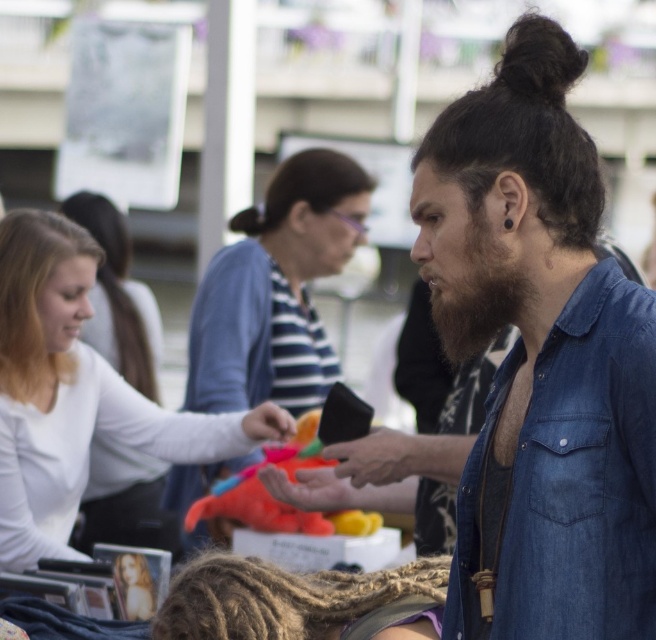
Measure the distance between white matte shirt at lower left and brown matte beard at center.

white matte shirt at lower left is 6.58 feet from brown matte beard at center.

Looking at this image, does white matte shirt at lower left appear on the right side of brown matte beard at center?

No, white matte shirt at lower left is not to the right of brown matte beard at center.

I want to click on white matte shirt at lower left, so click(75, 392).

Is brown matte beard at center to the right of plush orange toy at center from the viewer's perspective?

Correct, you'll find brown matte beard at center to the right of plush orange toy at center.

Which is behind, point (441, 316) or point (333, 524)?

Positioned behind is point (333, 524).

Where is `brown matte beard at center`? Image resolution: width=656 pixels, height=640 pixels. brown matte beard at center is located at coordinates (478, 292).

Between striped fabric shirt at center and plush orange toy at center, which one is positioned lower?

plush orange toy at center is below.

Is point (234, 353) closer to camera compared to point (201, 516)?

No.

Does point (289, 230) come farther from viewer compared to point (323, 518)?

Yes, it is.

The width and height of the screenshot is (656, 640). I want to click on striped fabric shirt at center, so click(x=276, y=289).